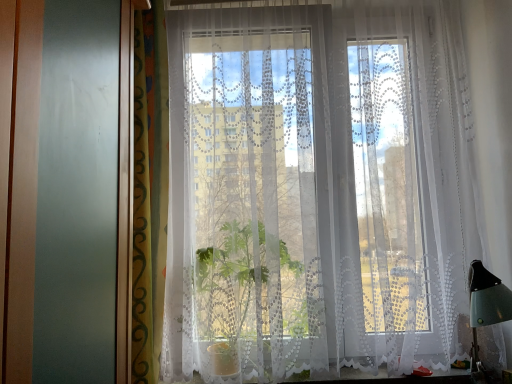
Question: Can you confirm if white lace curtain at center, positioned as the 1th curtain in right-to-left order, is positioned to the left of white lace curtain at lower center?

Choices:
 (A) yes
 (B) no

Answer: (B)

Question: Is white lace curtain at center, positioned as the 1th curtain in right-to-left order, next to white lace curtain at lower center and touching it?

Choices:
 (A) yes
 (B) no

Answer: (B)

Question: Is white lace curtain at center, placed as the 2th curtain when sorted from left to right, aimed at white lace curtain at lower center?

Choices:
 (A) no
 (B) yes

Answer: (A)

Question: From the image's perspective, does white lace curtain at center, placed as the 2th curtain when sorted from left to right, appear lower than white lace curtain at lower center?

Choices:
 (A) no
 (B) yes

Answer: (A)

Question: Can you confirm if white lace curtain at center, positioned as the 1th curtain in right-to-left order, is thinner than white lace curtain at lower center?

Choices:
 (A) yes
 (B) no

Answer: (B)

Question: Is white lace curtain at center, positioned as the 1th curtain in right-to-left order, facing away from white lace curtain at lower center?

Choices:
 (A) no
 (B) yes

Answer: (A)

Question: Is green patterned curtain at left, the first curtain positioned from the left, taller than white lace curtain at center, placed as the 2th curtain when sorted from left to right?

Choices:
 (A) yes
 (B) no

Answer: (B)

Question: Considering the relative sizes of green patterned curtain at left, the first curtain positioned from the left, and white lace curtain at center, positioned as the 1th curtain in right-to-left order, in the image provided, is green patterned curtain at left, the first curtain positioned from the left, shorter than white lace curtain at center, positioned as the 1th curtain in right-to-left order,?

Choices:
 (A) yes
 (B) no

Answer: (A)

Question: Is green patterned curtain at left, the first curtain positioned from the left, placed right next to white lace curtain at center, placed as the 2th curtain when sorted from left to right?

Choices:
 (A) no
 (B) yes

Answer: (A)

Question: Considering the relative sizes of green patterned curtain at left, the first curtain positioned from the left, and white lace curtain at center, positioned as the 1th curtain in right-to-left order, in the image provided, is green patterned curtain at left, the first curtain positioned from the left, thinner than white lace curtain at center, positioned as the 1th curtain in right-to-left order,?

Choices:
 (A) no
 (B) yes

Answer: (B)

Question: Does green patterned curtain at left, arranged as the second curtain when viewed from the right, appear on the left side of white lace curtain at center, placed as the 2th curtain when sorted from left to right?

Choices:
 (A) yes
 (B) no

Answer: (A)

Question: Can you confirm if green patterned curtain at left, the first curtain positioned from the left, is smaller than white lace curtain at center, placed as the 2th curtain when sorted from left to right?

Choices:
 (A) no
 (B) yes

Answer: (B)

Question: Are white lace curtain at center, positioned as the 1th curtain in right-to-left order, and green patterned curtain at left, the first curtain positioned from the left, located far from each other?

Choices:
 (A) yes
 (B) no

Answer: (B)